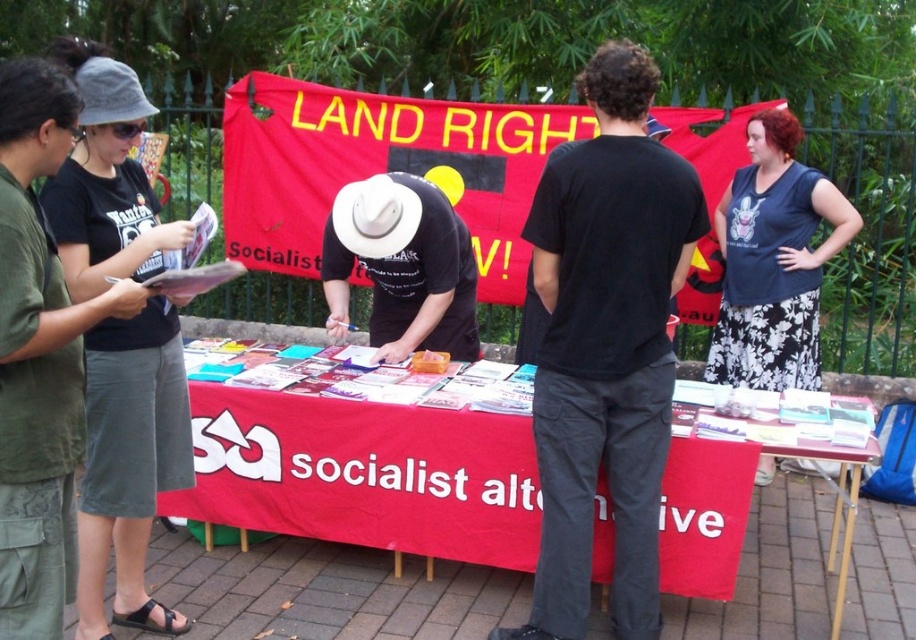
Is black cotton t-shirt at left bigger than white matte cowboy hat at center?

Indeed, black cotton t-shirt at left has a larger size compared to white matte cowboy hat at center.

Is point (138, 611) positioned before point (388, 176)?

Yes, it is.

Find the location of a particular element. The width and height of the screenshot is (916, 640). black cotton t-shirt at left is located at coordinates (129, 461).

Find the location of `black cotton t-shirt at left`. black cotton t-shirt at left is located at coordinates (129, 461).

Is red fabric table at center wider than white matte cowboy hat at center?

Indeed, red fabric table at center has a greater width compared to white matte cowboy hat at center.

Can you confirm if red fabric table at center is bigger than white matte cowboy hat at center?

Yes.

Does point (673, 456) lie behind point (391, 316)?

No, (673, 456) is closer to viewer.

Find the location of a particular element. The height and width of the screenshot is (640, 916). red fabric table at center is located at coordinates (365, 474).

What do you see at coordinates (365, 474) in the screenshot?
I see `red fabric table at center` at bounding box center [365, 474].

Who is more distant from viewer, (x=300, y=508) or (x=849, y=221)?

Positioned behind is point (x=849, y=221).

Identify the location of red fabric table at center. (365, 474).